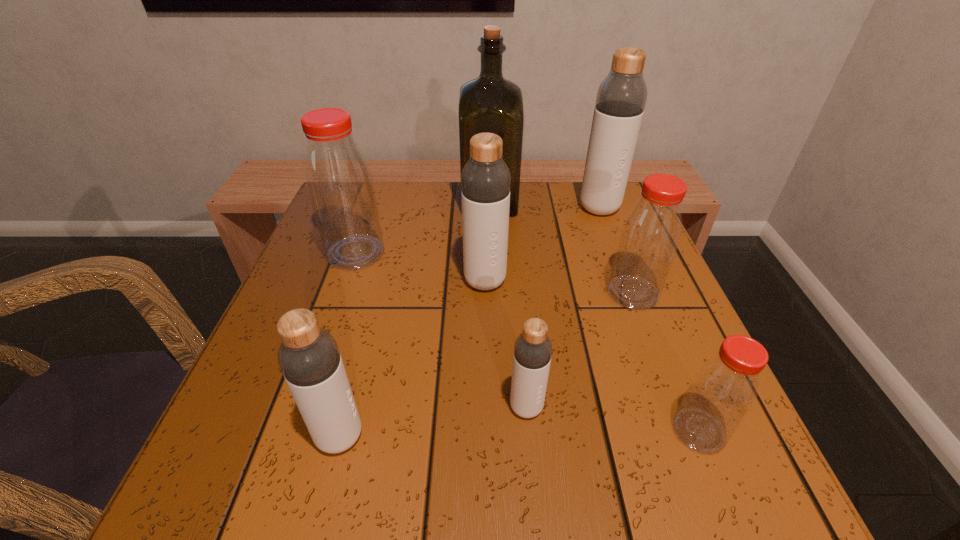
You are a GUI agent. You are given a task and a screenshot of the screen. Output one action in this format:
    pyautogui.click(x=<x>, y=<y>)
    Task: Click on the liquor
    The height and width of the screenshot is (540, 960).
    Given the screenshot: What is the action you would take?
    pyautogui.click(x=488, y=104)

Identify the location of the biggest gray bottle. (621, 97).

I want to click on the tallest bottle, so click(621, 97).

Identify the location of the biggest red bottle. (340, 186).

You are a GUI agent. You are given a task and a screenshot of the screen. Output one action in this format:
    pyautogui.click(x=<x>, y=<y>)
    Task: Click on the leftmost red bottle
    
    Given the screenshot: What is the action you would take?
    pyautogui.click(x=340, y=186)

You are a GUI agent. You are given a task and a screenshot of the screen. Output one action in this format:
    pyautogui.click(x=<x>, y=<y>)
    Task: Click on the second farthest gray bottle
    
    Given the screenshot: What is the action you would take?
    pyautogui.click(x=485, y=180)

This screenshot has width=960, height=540. In order to click on the second nearest red bottle in this screenshot , I will do `click(650, 235)`.

Locate an element on the screen. This screenshot has width=960, height=540. the leftmost gray bottle is located at coordinates (309, 358).

In order to click on the smallest gray bottle in this screenshot , I will do pos(532,354).

I want to click on the nearest red bottle, so click(724, 388).